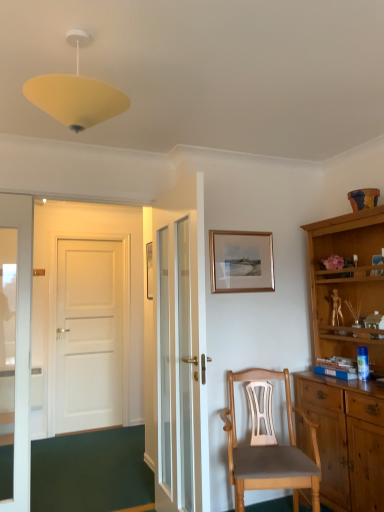
Question: From the image's perspective, is white glass door at center under gold metallic picture frame at upper center?

Choices:
 (A) no
 (B) yes

Answer: (B)

Question: Is white glass door at center to the right of gold metallic picture frame at upper center from the viewer's perspective?

Choices:
 (A) yes
 (B) no

Answer: (B)

Question: Is white glass door at center oriented towards gold metallic picture frame at upper center?

Choices:
 (A) yes
 (B) no

Answer: (A)

Question: Would you say gold metallic picture frame at upper center is part of white glass door at center's contents?

Choices:
 (A) no
 (B) yes

Answer: (A)

Question: Is white glass door at center next to gold metallic picture frame at upper center and touching it?

Choices:
 (A) no
 (B) yes

Answer: (A)

Question: Is point (228, 282) closer or farther from the camera than point (190, 297)?

Choices:
 (A) farther
 (B) closer

Answer: (A)

Question: Is gold metallic picture frame at upper center spatially inside white glass door at center, or outside of it?

Choices:
 (A) inside
 (B) outside

Answer: (B)

Question: Based on their sizes in the image, would you say gold metallic picture frame at upper center is bigger or smaller than white glass door at center?

Choices:
 (A) big
 (B) small

Answer: (B)

Question: From a real-world perspective, is gold metallic picture frame at upper center physically located above or below white glass door at center?

Choices:
 (A) below
 (B) above

Answer: (B)

Question: From a real-world perspective, relative to white glass door at center, is light brown wooden chair at center vertically above or below?

Choices:
 (A) below
 (B) above

Answer: (A)

Question: Based on their positions, is light brown wooden chair at center located to the left or right of white glass door at center?

Choices:
 (A) right
 (B) left

Answer: (A)

Question: From the image's perspective, is light brown wooden chair at center positioned above or below white glass door at center?

Choices:
 (A) above
 (B) below

Answer: (B)

Question: Relative to white glass door at center, is light brown wooden chair at center in front or behind?

Choices:
 (A) behind
 (B) front

Answer: (A)

Question: From the image's perspective, relative to light brown wooden chair at center, is yellow matte/soft plastic lampshade at upper center above or below?

Choices:
 (A) below
 (B) above

Answer: (B)

Question: Is yellow matte/soft plastic lampshade at upper center to the left or to the right of light brown wooden chair at center in the image?

Choices:
 (A) right
 (B) left

Answer: (B)